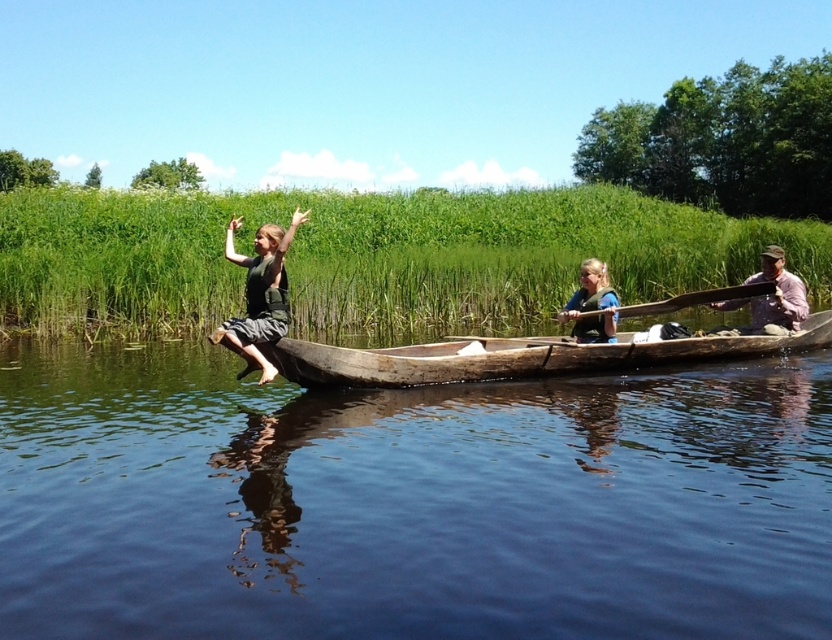
Based on the photo, you are a safety inspector checking the canoe. The life vest and paddle are both at the center. How far apart are the matte blue life vest at center and the wooden paddle at center?

The matte blue life vest at center and wooden paddle at center are 24.20 centimeters apart.

You are a safety inspector checking the canoe setup. The transparent water at boat front and the matte blue life vest at center are both visible. According to safety regulations, life vests must be worn and accessible. Is the current arrangement compliant?

The transparent water at boat front is located below matte blue life vest at center, which means the life vest is submerged and not accessible. This violates safety regulations as the matte blue life vest at center must be easily reachable. The arrangement is not compliant.